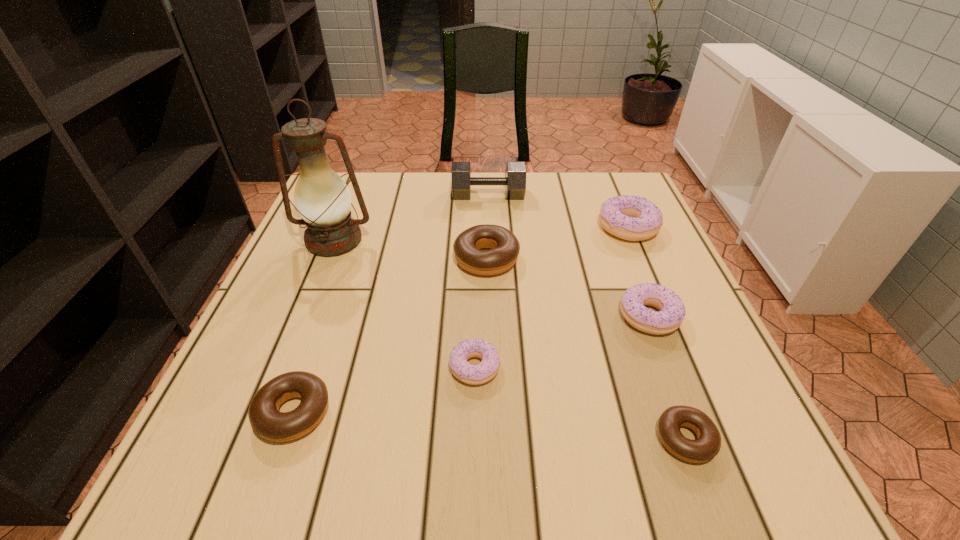
The width and height of the screenshot is (960, 540). I want to click on free space at the right edge, so click(x=609, y=274).

What are the coordinates of `vacant space at the near left corner` in the screenshot? It's located at (248, 456).

Identify the location of blank space at the far right corner of the desktop. This screenshot has height=540, width=960. (604, 181).

This screenshot has width=960, height=540. Identify the location of free spot between the farthest object and the second smallest brown doughnut. (391, 304).

Where is `empty space between the farthest brown doughnut and the oil lamp`? This screenshot has height=540, width=960. empty space between the farthest brown doughnut and the oil lamp is located at coordinates (410, 249).

Where is `vacant region between the farthest brown doughnut and the leftmost brown doughnut`? vacant region between the farthest brown doughnut and the leftmost brown doughnut is located at coordinates (390, 335).

The height and width of the screenshot is (540, 960). I want to click on vacant space in between the farthest object and the rightmost brown doughnut, so click(x=587, y=317).

This screenshot has width=960, height=540. Find the location of `blank region between the second brown doughnut from right to left and the farthest purple doughnut`. blank region between the second brown doughnut from right to left and the farthest purple doughnut is located at coordinates (557, 243).

The height and width of the screenshot is (540, 960). What are the coordinates of `empty space between the farthest purple doughnut and the nearest purple doughnut` in the screenshot? It's located at (551, 298).

Image resolution: width=960 pixels, height=540 pixels. I want to click on free space between the fourth nearest object and the oil lamp, so click(492, 279).